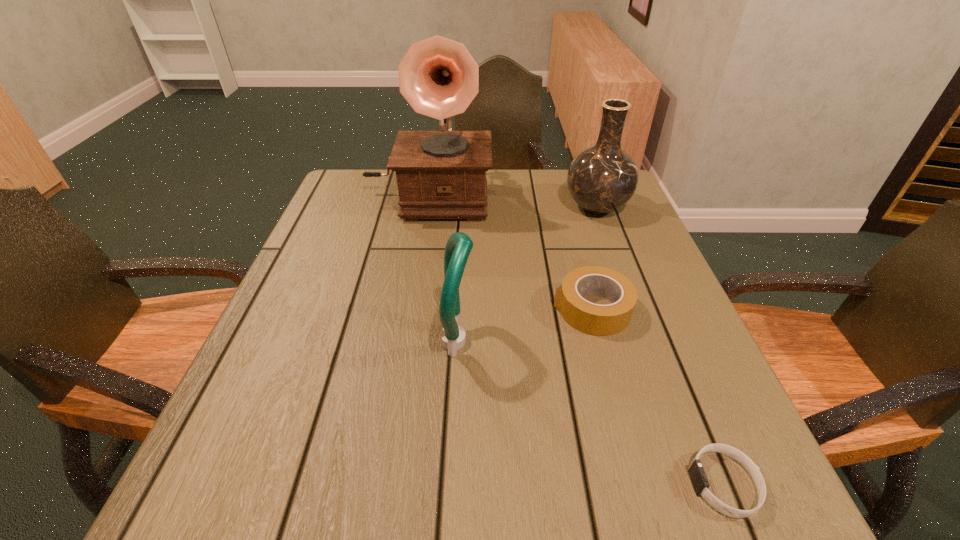
You are a GUI agent. You are given a task and a screenshot of the screen. Output one action in this format:
    pyautogui.click(x=<x>, y=<y>)
    Task: Click on the vacant space that's between the vase and the duct tape
    
    Given the screenshot: What is the action you would take?
    pyautogui.click(x=594, y=259)

You are a GUI agent. You are given a task and a screenshot of the screen. Output one action in this format:
    pyautogui.click(x=<x>, y=<y>)
    Task: Click on the free spot between the third tallest object and the record player
    The image size is (960, 540).
    Given the screenshot: What is the action you would take?
    pyautogui.click(x=444, y=269)

This screenshot has height=540, width=960. I want to click on vacant area that lies between the vase and the nearest object, so click(660, 346).

I want to click on free space between the bottle opener and the vase, so click(527, 274).

The image size is (960, 540). I want to click on empty space between the tallest object and the third shortest object, so pyautogui.click(x=444, y=269).

This screenshot has height=540, width=960. I want to click on vacant region between the tallest object and the second shortest object, so click(510, 253).

Identify the location of empty space that is in between the record player and the vase. (513, 202).

Locate an element on the screen. empty space that is in between the second shortest object and the third tallest object is located at coordinates (525, 325).

Image resolution: width=960 pixels, height=540 pixels. Identify the location of free spot between the wristband and the fourth tallest object. (658, 397).

This screenshot has height=540, width=960. Identify the location of vacant area that lies between the vase and the third shortest object. (527, 274).